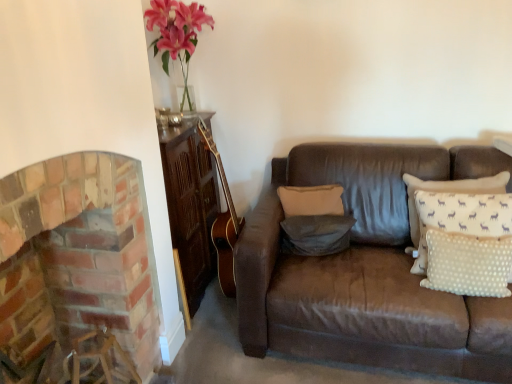
Question: From a real-world perspective, relative to brick fireplace at left, is beige fabric pillow at center, which is the third pillow from front to back, vertically above or below?

Choices:
 (A) above
 (B) below

Answer: (A)

Question: Is beige fabric pillow at center, placed as the 1th pillow when sorted from back to front, situated inside brick fireplace at left or outside?

Choices:
 (A) outside
 (B) inside

Answer: (A)

Question: Which object is the closest to the beige fabric pillow at center, placed as the 1th pillow when sorted from back to front?

Choices:
 (A) white dotted fabric pillow at right, marked as the 1th pillow in a front-to-back arrangement
 (B) brick fireplace at left
 (C) gray fabric pillow at center, the 2th pillow in the back-to-front sequence

Answer: (C)

Question: Which object is positioned farthest from the gray fabric pillow at center, the 2th pillow in the back-to-front sequence?

Choices:
 (A) white dotted fabric pillow at right, the 3th pillow viewed from the back
 (B) beige fabric pillow at center, placed as the 1th pillow when sorted from back to front
 (C) brick fireplace at left

Answer: (C)